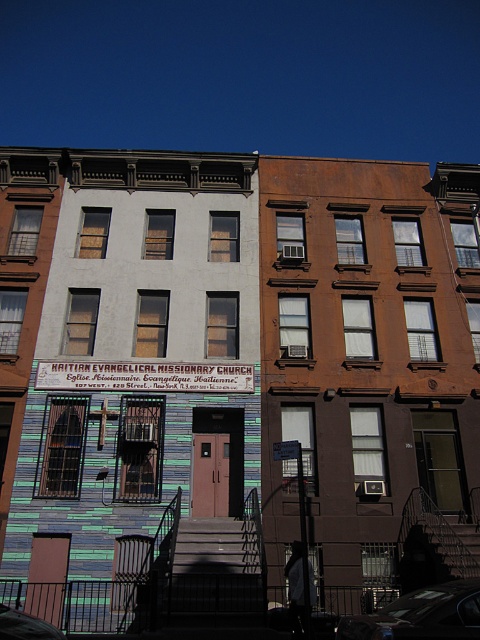
You are a delivery person trying to find the entrance to the Haitian Evangelical Missionary Church. You see the metallic silver sign at center and the metallic car at lower right. According to the scene, which object is closer to the church entrance?

The metallic silver sign at center is positioned on the left side of the metallic car at lower right. Since the church entrance is marked by a pink, the sign is likely closer to the entrance than the car.

You are a delivery driver approaching the street where the metallic silver sign at center and the metallic car at lower right are located. From your viewpoint, which object is closer to you?

The metallic silver sign at center is closer to you because the metallic car at lower right is behind it.

What is located at the point with coordinates (144, 376) in the image?

A metallic silver sign at center is located at the point with coordinates (144, 376).